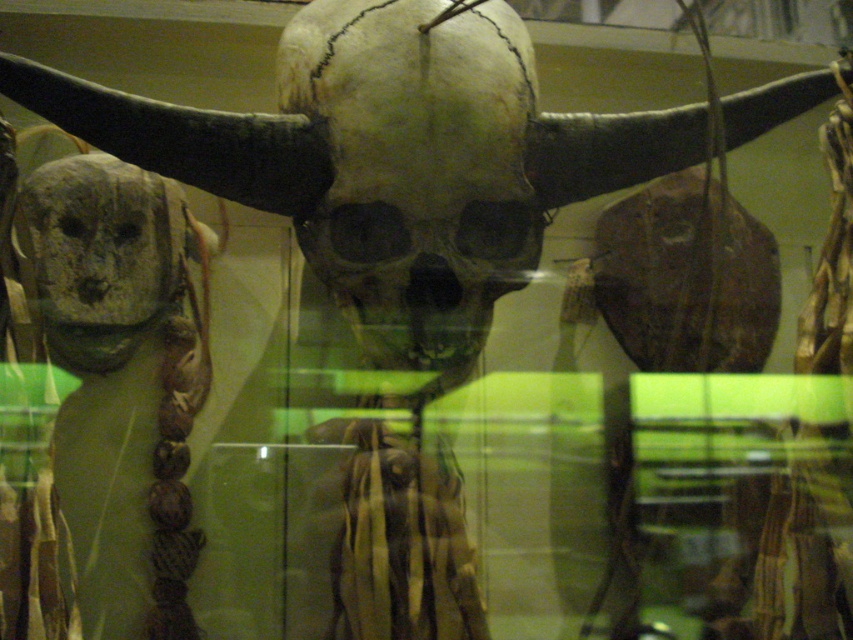
Based on the museum exhibit scene, where is the matte white skull at center located relative to the gray stone skull at left?

A: The matte white skull at center is to the right of gray stone skull at left.

You are a museum curator planning to install a new lighting system. You need to ensure that the light can reach the matte white skull at center. Given that the light source will be placed at point (416, 168), will the light hit the matte white skull at center?

The light source is placed exactly at the location of the matte white skull at center, so yes, the light will directly illuminate it.

Based on the scene description, which object is wider, the matte white skull at center or the gray stone skull at left?

The matte white skull at center is wider than the gray stone skull at left according to the description.